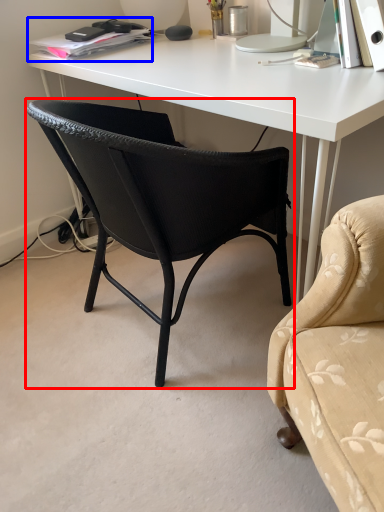
Question: Which point is closer to the camera, chair (highlighted by a red box) or book (highlighted by a blue box)?

Choices:
 (A) chair
 (B) book

Answer: (A)